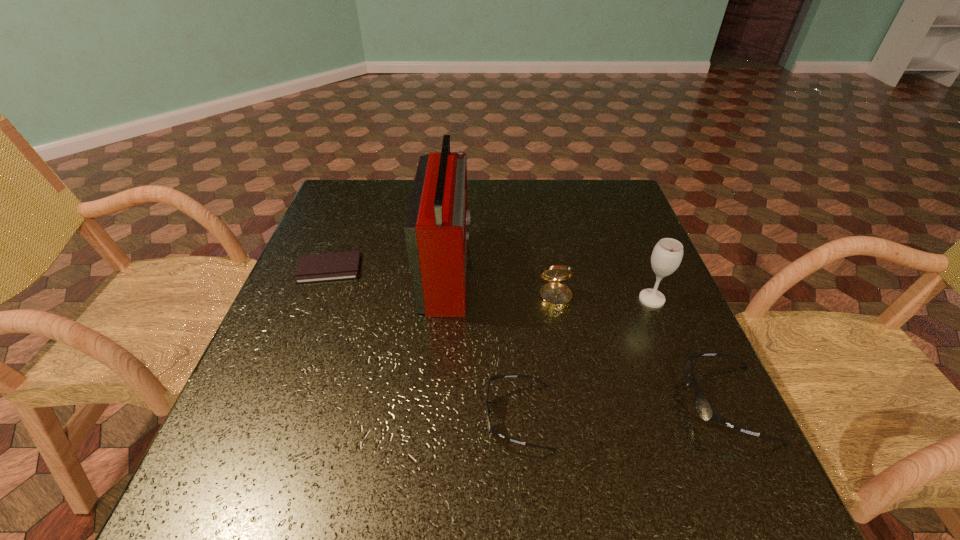
This screenshot has height=540, width=960. In the image, there is a desktop. In order to click on vacant space at the near left corner in this screenshot , I will do `click(231, 416)`.

The image size is (960, 540). I want to click on free space at the near right corner, so click(x=732, y=435).

Identify the location of free space between the radio receiver and the fifth tallest object. (483, 342).

Where is `vacant space that is in between the checkbook and the shorter sunglasses`? The width and height of the screenshot is (960, 540). vacant space that is in between the checkbook and the shorter sunglasses is located at coordinates (424, 342).

Find the location of `unoccupied area between the fourth shortest object and the left sunglasses`. unoccupied area between the fourth shortest object and the left sunglasses is located at coordinates (538, 359).

The width and height of the screenshot is (960, 540). I want to click on vacant area that lies between the shorter sunglasses and the fourth shortest object, so click(x=538, y=359).

This screenshot has width=960, height=540. I want to click on free space between the fourth object from left to right and the wineglass, so click(x=604, y=300).

This screenshot has width=960, height=540. I want to click on vacant area that lies between the taller sunglasses and the fifth object from right to left, so click(587, 336).

Locate an element on the screen. vacant area that lies between the shorter sunglasses and the fifth shortest object is located at coordinates (586, 358).

The width and height of the screenshot is (960, 540). I want to click on blank region between the leftmost object and the left sunglasses, so click(424, 342).